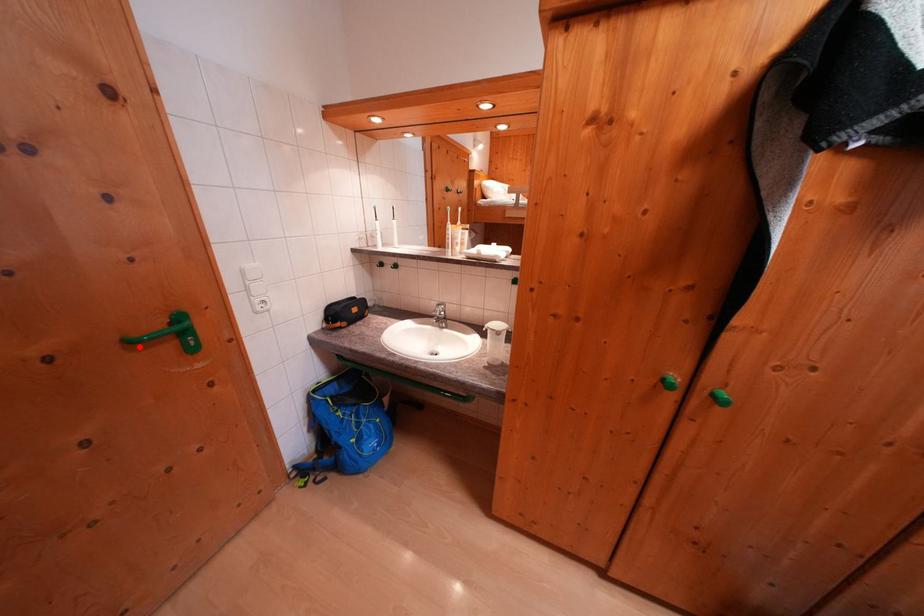
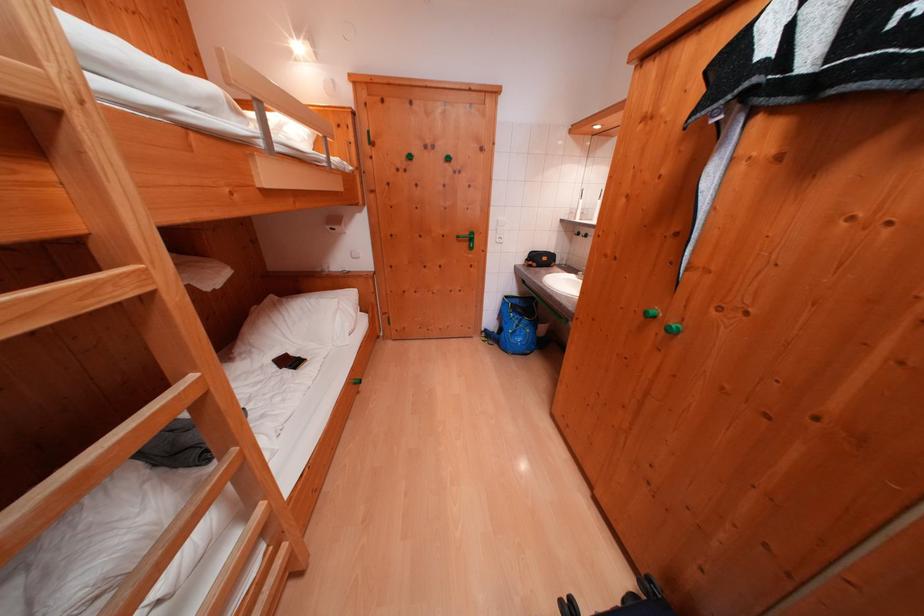
Question: I am providing you with two images of the same scene from different viewpoints. A red point is shown in image1. For the corresponding object point in image2, is it positioned nearer or farther from the camera?

Choices:
 (A) Nearer
 (B) Farther

Answer: (A)